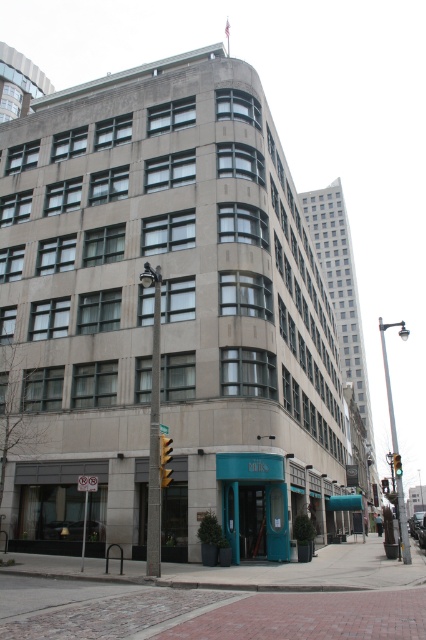
Question: Which of the following is the closest to the observer?

Choices:
 (A) yellow plastic traffic light at lower center
 (B) green glass traffic light at upper right

Answer: (A)

Question: Does yellow plastic traffic light at lower center have a larger size compared to green glass traffic light at upper right?

Choices:
 (A) yes
 (B) no

Answer: (B)

Question: Is yellow plastic traffic light at lower center bigger than green glass traffic light at upper right?

Choices:
 (A) no
 (B) yes

Answer: (A)

Question: Is yellow plastic traffic light at lower center positioned at the back of green glass traffic light at upper right?

Choices:
 (A) no
 (B) yes

Answer: (A)

Question: Among these objects, which one is farthest from the camera?

Choices:
 (A) green glass traffic light at upper right
 (B) yellow plastic traffic light at lower center

Answer: (A)

Question: Which point is closer to the camera?

Choices:
 (A) (166, 456)
 (B) (400, 472)

Answer: (A)